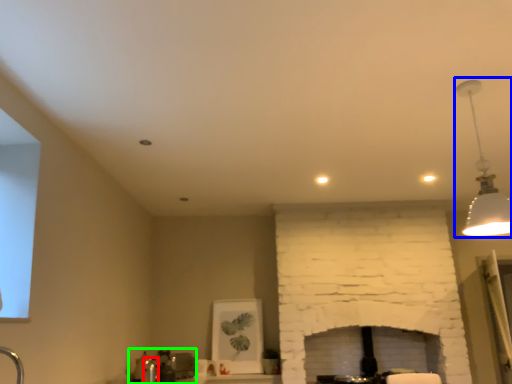
Question: Which object is positioned farthest from faucet (highlighted by a red box)? Select from lamp (highlighted by a blue box) and sink (highlighted by a green box).

Choices:
 (A) lamp
 (B) sink

Answer: (A)